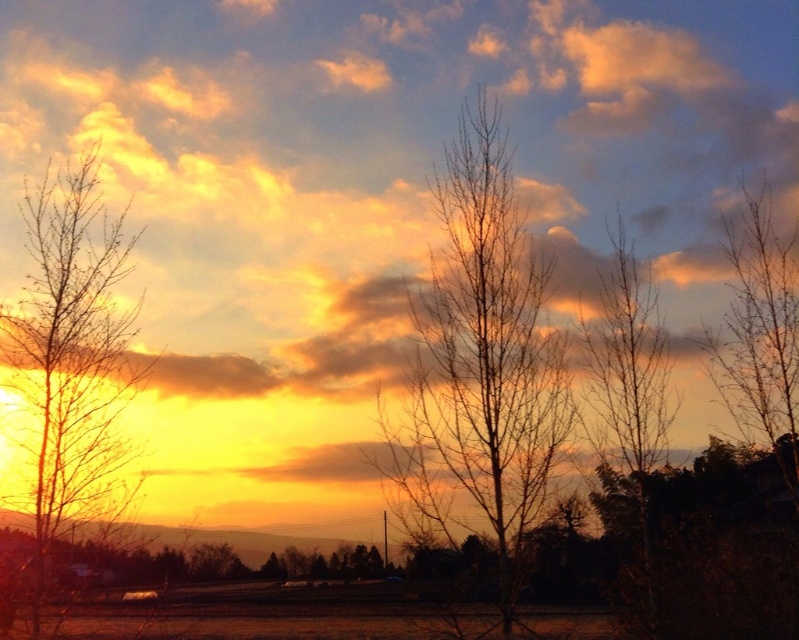
You are an artist trying to paint the sunset scene. You want to place the bare branches at left in your painting. According to the image, where should you position them in terms of coordinates?

The bare branches at left should be positioned at coordinates point (70,360) as per the image description.

You are an artist trying to paint the sunset scene. You notice two groups of bare branches in the foreground. Which group of branches, the bare branches at center or the bare branches at left, reaches higher into the sky?

The bare branches at center reaches higher into the sky compared to the bare branches at left.